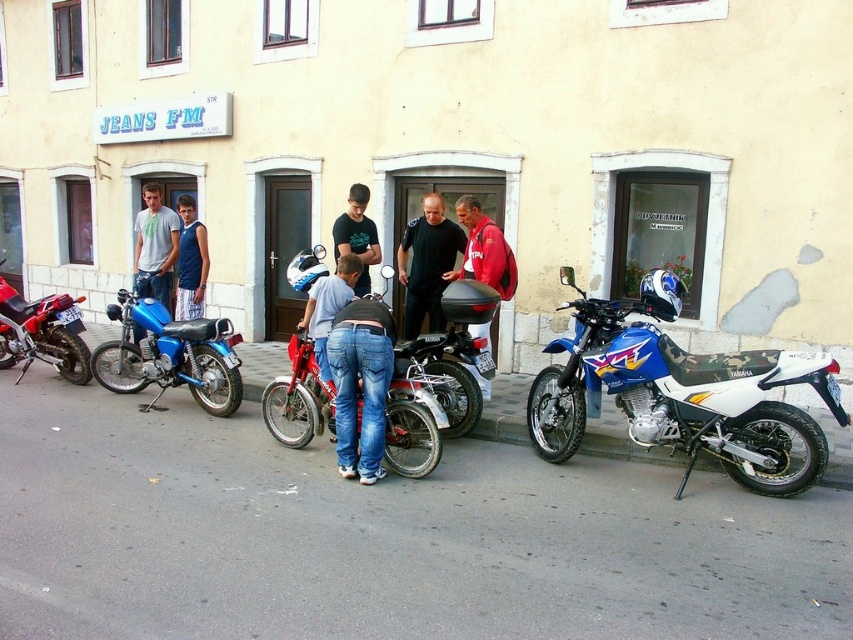
Question: Is shiny black motorcycle at center smaller than dark blue jeans at center?

Choices:
 (A) no
 (B) yes

Answer: (A)

Question: Estimate the real-world distances between objects in this image. Which object is closer to the metallic red motorcycle at center?

Choices:
 (A) red matte jacket at center
 (B) light blue denim jeans at center
 (C) camo-textured motorcycle at right

Answer: (A)

Question: Which object is farther from the camera taking this photo?

Choices:
 (A) light blue denim jeans at center
 (B) blue metallic motorcycle at left
 (C) blue fabric shirt at center
 (D) dark blue jeans at center

Answer: (C)

Question: Among these points, which one is farthest from the camera?

Choices:
 (A) (293, 349)
 (B) (421, 224)
 (C) (485, 273)

Answer: (B)

Question: Considering the relative positions of shiny black motorcycle at center and dark blue jeans at center in the image provided, where is shiny black motorcycle at center located with respect to dark blue jeans at center?

Choices:
 (A) right
 (B) left

Answer: (A)

Question: Can you confirm if shiny red motorcycle at left is bigger than black leather jacket at center?

Choices:
 (A) no
 (B) yes

Answer: (B)